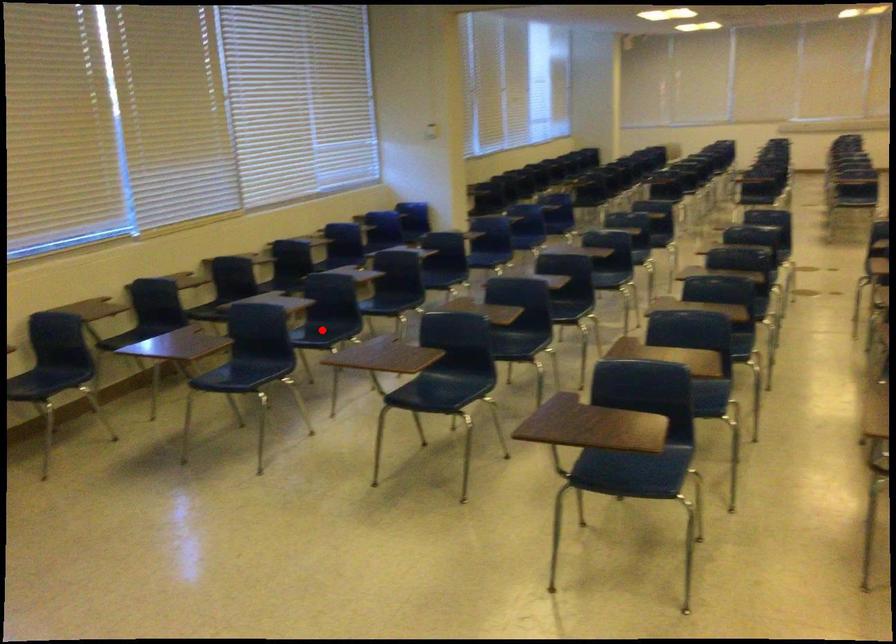
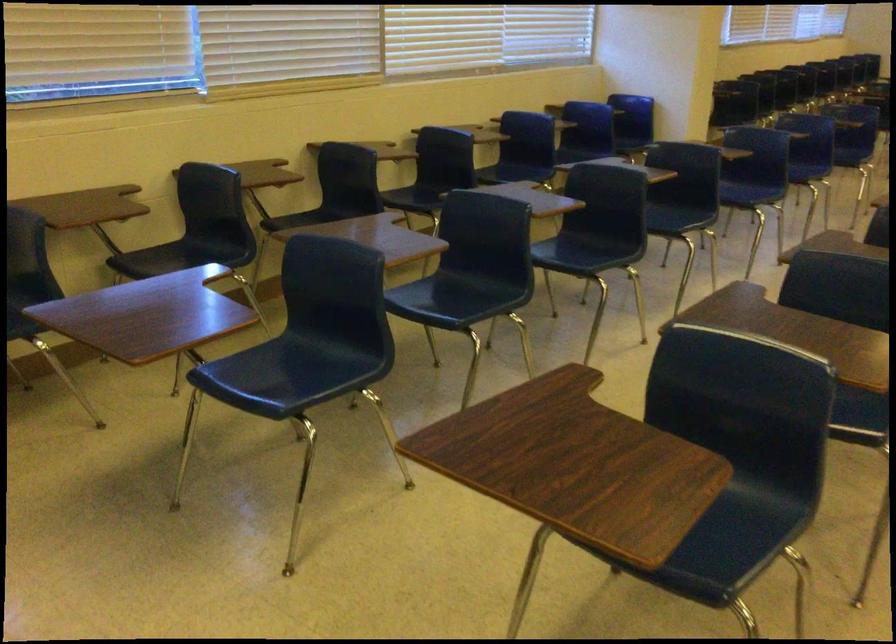
The point at the highlighted location is marked in the first image. Where is the corresponding point in the second image?

(462, 292)